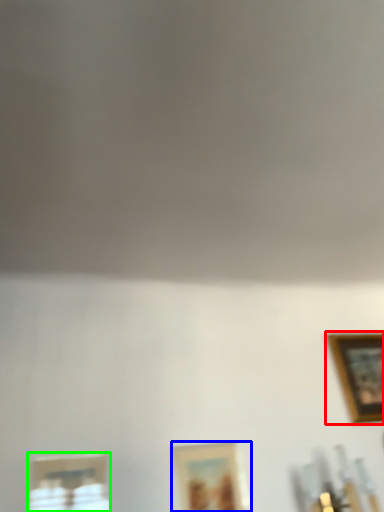
Question: Considering the real-world distances, which object is closest to picture frame (highlighted by a red box)? picture frame (highlighted by a blue box) or picture frame (highlighted by a green box).

Choices:
 (A) picture frame
 (B) picture frame

Answer: (A)